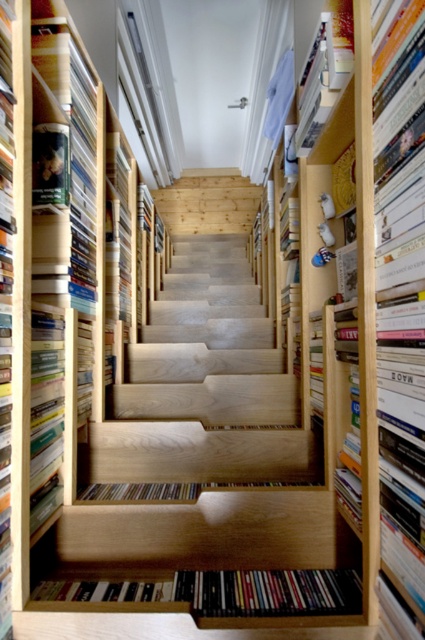
You are a delivery person trying to move a large box that is 20 inches wide through the space between the natural wood stairs at center and the light brown wood bookshelf at center. Can you fit the box through the space between them?

The natural wood stairs at center and light brown wood bookshelf at center are 21.21 inches apart from each other. Since the box is 20 inches wide, it should fit through the space between them as there is enough clearance.